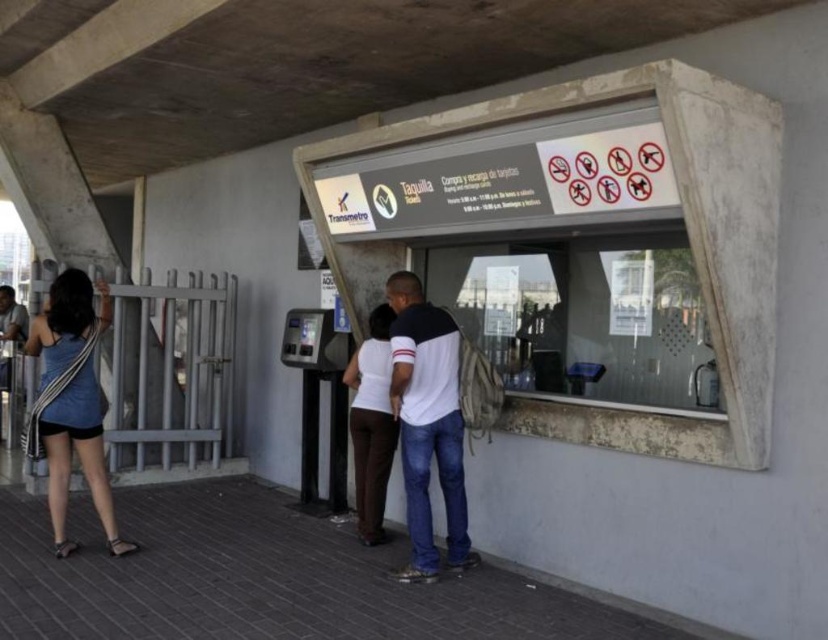
Question: Can you confirm if white cotton shirt at center is positioned to the right of white matte pants at center?

Choices:
 (A) no
 (B) yes

Answer: (B)

Question: Does white cotton shirt at center have a smaller size compared to white matte pants at center?

Choices:
 (A) yes
 (B) no

Answer: (B)

Question: Is white cotton shirt at center above white matte pants at center?

Choices:
 (A) yes
 (B) no

Answer: (A)

Question: Which point is closer to the camera?

Choices:
 (A) (368, 460)
 (B) (70, 307)

Answer: (B)

Question: Which point appears farthest from the camera in this image?

Choices:
 (A) (51, 433)
 (B) (368, 477)

Answer: (B)

Question: Which point is farther from the camera taking this photo?

Choices:
 (A) (94, 467)
 (B) (393, 419)
 (C) (407, 483)

Answer: (B)